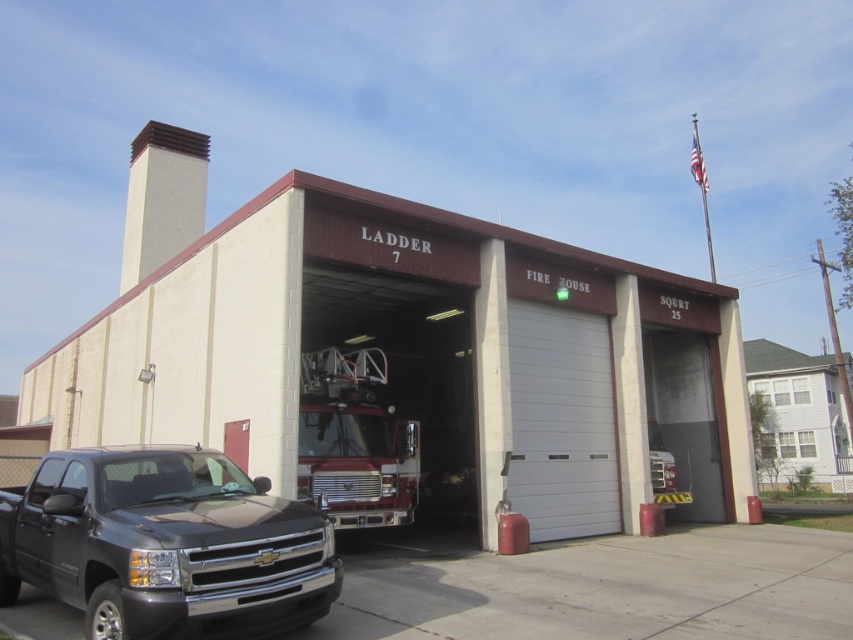
Which is in front, point (129, 620) or point (306, 499)?

Point (129, 620) is in front.

Is point (158, 632) positioned before point (325, 378)?

Yes, point (158, 632) is in front of point (325, 378).

Where is `black glossy pickup truck at lower left`? Image resolution: width=853 pixels, height=640 pixels. black glossy pickup truck at lower left is located at coordinates (165, 545).

Between white smooth fire station at center and black glossy pickup truck at lower left, which one appears on the right side from the viewer's perspective?

From the viewer's perspective, black glossy pickup truck at lower left appears more on the right side.

Does white smooth fire station at center have a lesser width compared to black glossy pickup truck at lower left?

No.

Does point (718, 436) come farther from viewer compared to point (125, 614)?

Yes, point (718, 436) is farther from viewer.

Where is `white smooth fire station at center`? This screenshot has height=640, width=853. white smooth fire station at center is located at coordinates (404, 358).

Is white smooth garage door at center taller than shiny red fire truck at center?

Yes.

Does white smooth garage door at center have a greater width compared to shiny red fire truck at center?

Correct, the width of white smooth garage door at center exceeds that of shiny red fire truck at center.

Between point (589, 324) and point (357, 454), which one is positioned behind?

The point (589, 324) is more distant.

Where is `white smooth garage door at center`? Image resolution: width=853 pixels, height=640 pixels. white smooth garage door at center is located at coordinates coord(561,422).